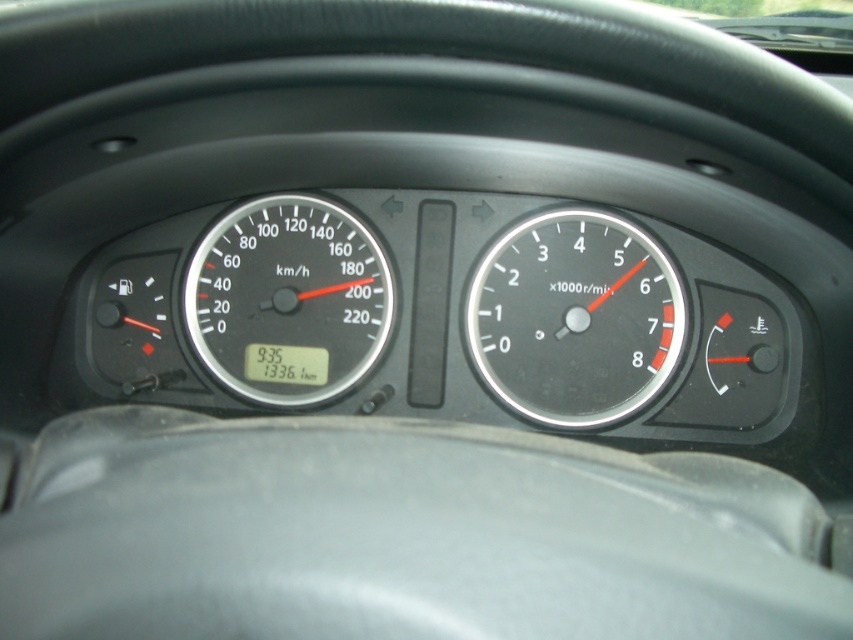
Where is the metallic silver speedometer at center located in the image?

The metallic silver speedometer at center is located at point (x=573, y=317).